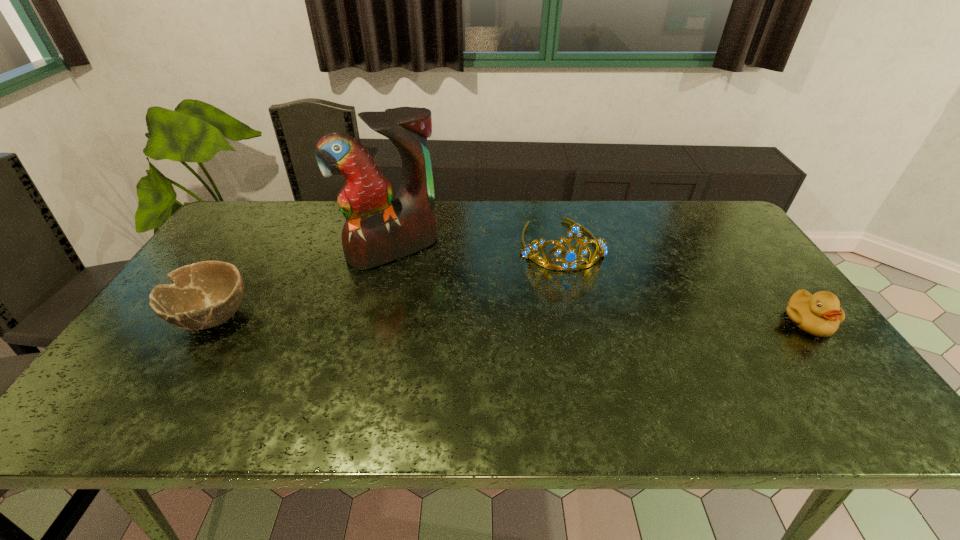
At what (x,y) coordinates should I click in order to perform the action: click on bowl. Please return your answer as a coordinate pair (x, y). Looking at the image, I should click on (202, 295).

The width and height of the screenshot is (960, 540). I want to click on duckling, so click(820, 314).

At what (x,y) coordinates should I click in order to perform the action: click on tiara. Please return your answer as a coordinate pair (x, y). Looking at the image, I should click on pos(569,263).

You are a GUI agent. You are given a task and a screenshot of the screen. Output one action in this format:
    pyautogui.click(x=<x>, y=<y>)
    Task: Click on the third object from left to right
    The width and height of the screenshot is (960, 540).
    Given the screenshot: What is the action you would take?
    pyautogui.click(x=569, y=263)

The image size is (960, 540). I want to click on parrot, so click(378, 229).

Locate an element on the screen. the tallest object is located at coordinates (378, 229).

This screenshot has width=960, height=540. In order to click on blank space located on the right of the leftmost object in this screenshot , I will do point(337,317).

The width and height of the screenshot is (960, 540). Identify the location of blank space located on the front-facing side of the tiara. (581, 313).

Image resolution: width=960 pixels, height=540 pixels. What are the coordinates of `free space located on the front-facing side of the tiara` in the screenshot? It's located at (573, 287).

Where is `blank area located 0.180m on the front-facing side of the tiara`? Image resolution: width=960 pixels, height=540 pixels. blank area located 0.180m on the front-facing side of the tiara is located at coordinates (582, 318).